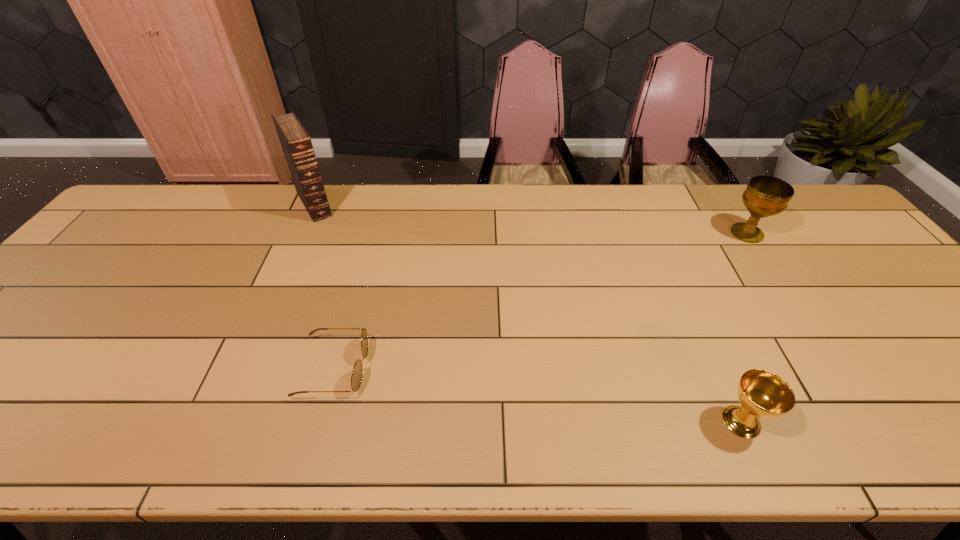
This screenshot has width=960, height=540. Find the location of `blank region between the leftmost object and the second object from left to right`. blank region between the leftmost object and the second object from left to right is located at coordinates (324, 286).

The height and width of the screenshot is (540, 960). I want to click on vacant region between the nearer chalice and the shortest object, so click(538, 395).

Where is `unoccupied position between the right chalice and the sunglasses`? unoccupied position between the right chalice and the sunglasses is located at coordinates (540, 301).

Identify the location of free space between the nearer chalice and the shortest object. This screenshot has width=960, height=540. [538, 395].

Where is `vacant space in between the taller chalice and the tallest object`? This screenshot has width=960, height=540. vacant space in between the taller chalice and the tallest object is located at coordinates (531, 219).

At what (x,y) coordinates should I click in order to perform the action: click on vacant area between the nearer chalice and the sunglasses. Please return your answer as a coordinate pair (x, y). The width and height of the screenshot is (960, 540). Looking at the image, I should click on (538, 395).

This screenshot has width=960, height=540. I want to click on vacant area between the taller chalice and the shorter chalice, so click(x=744, y=328).

Locate an element on the screen. The width and height of the screenshot is (960, 540). vacant area that lies between the tallest object and the sunglasses is located at coordinates (324, 286).

Identify the location of free spot between the left chalice and the right chalice. The image size is (960, 540). (744, 328).

At what (x,y) coordinates should I click in order to perform the action: click on vacant area that lies between the third tallest object and the farther chalice. Please return your answer as a coordinate pair (x, y). Image resolution: width=960 pixels, height=540 pixels. Looking at the image, I should click on (744, 328).